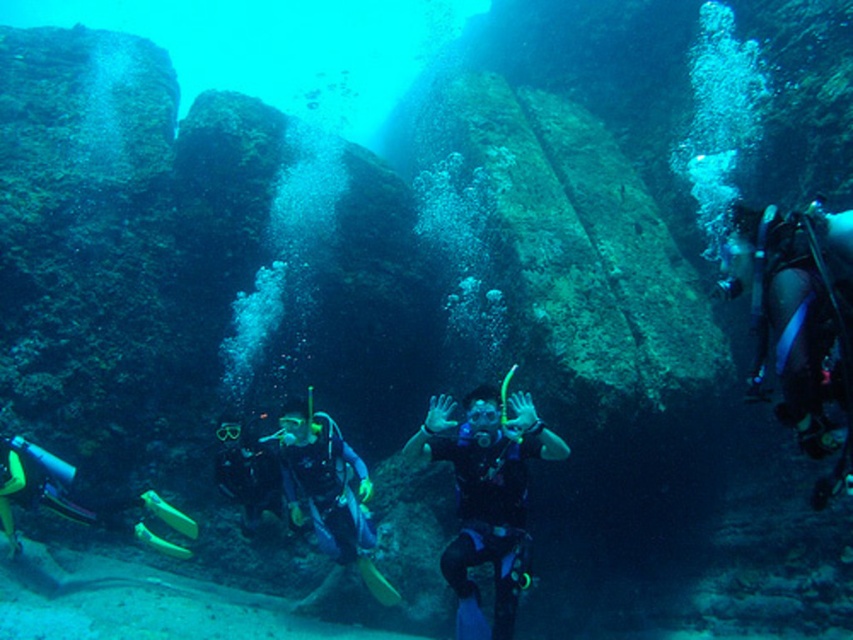
You are a marine biologist observing the underwater scene. You see the black matte scuba diver at center and the blue matte scuba diver at center. Which diver is positioned to the right of the other?

The black matte scuba diver at center is to the right of the blue matte scuba diver at center.

You are a marine biologist observing the underwater scene. You notice two divers, the black matte scuba diver at center and the matte black scuba diver at right. Based on their positions, which diver is closer to the ocean floor?

The black matte scuba diver at center is located below the matte black scuba diver at right, so the black matte scuba diver at center is closer to the ocean floor.

You are a marine biologist observing the underwater scene. You notice two divers, the black matte scuba diver at center and the blue matte scuba diver at center. Which diver is located above the other in the water column?

The black matte scuba diver at center is positioned over the blue matte scuba diver at center, meaning the black diver is above the blue diver in the water column.